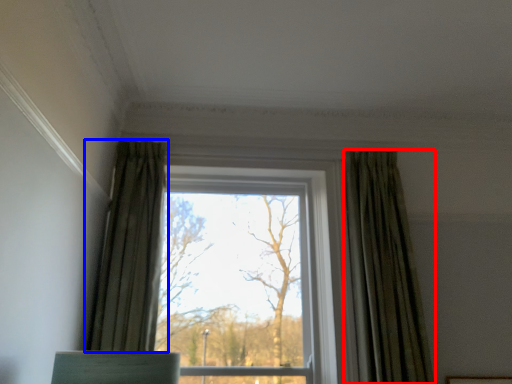
Question: Which object is closer to the camera taking this photo, curtain (highlighted by a red box) or curtain (highlighted by a blue box)?

Choices:
 (A) curtain
 (B) curtain

Answer: (B)